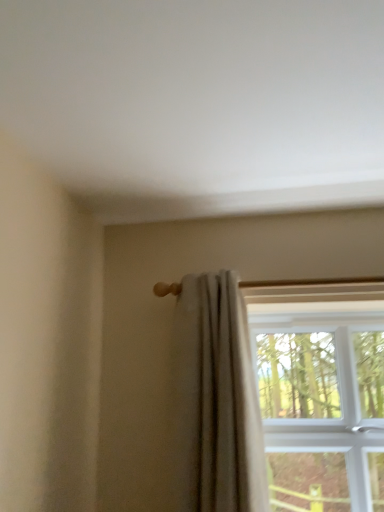
Consider the image. In order to face light beige fabric curtain at center, should I rotate leftwards or rightwards?

You should rotate right by 3.807 degrees.

What do you see at coordinates (215, 400) in the screenshot? Image resolution: width=384 pixels, height=512 pixels. I see `light beige fabric curtain at center` at bounding box center [215, 400].

At what (x,y) coordinates should I click in order to perform the action: click on light beige fabric curtain at center. Please return your answer as a coordinate pair (x, y). This screenshot has height=512, width=384. Looking at the image, I should click on (215, 400).

Identify the location of clear glass window at upper right. (321, 393).

What do you see at coordinates (321, 393) in the screenshot? This screenshot has height=512, width=384. I see `clear glass window at upper right` at bounding box center [321, 393].

The image size is (384, 512). In order to click on light beige fabric curtain at center in this screenshot , I will do `click(215, 400)`.

Is light beige fabric curtain at center at the left side of clear glass window at upper right?

Correct, you'll find light beige fabric curtain at center to the left of clear glass window at upper right.

Considering their positions, is light beige fabric curtain at center located in front of or behind clear glass window at upper right?

In the image, light beige fabric curtain at center appears in front of clear glass window at upper right.

Does point (199, 286) appear closer or farther from the camera than point (283, 447)?

Point (199, 286) is closer to the camera than point (283, 447).

From the image's perspective, is light beige fabric curtain at center positioned above or below clear glass window at upper right?

light beige fabric curtain at center is situated higher than clear glass window at upper right in the image.

From a real-world perspective, does light beige fabric curtain at center stand above clear glass window at upper right?

Yes.

Does light beige fabric curtain at center have a lesser width compared to clear glass window at upper right?

Yes.

From their relative heights in the image, would you say light beige fabric curtain at center is taller or shorter than clear glass window at upper right?

In the image, light beige fabric curtain at center appears to be taller than clear glass window at upper right.

Looking at the image, does light beige fabric curtain at center seem bigger or smaller compared to clear glass window at upper right?

Considering their sizes, light beige fabric curtain at center takes up less space than clear glass window at upper right.

Is light beige fabric curtain at center situated inside clear glass window at upper right or outside?

light beige fabric curtain at center is located beyond the bounds of clear glass window at upper right.

Are light beige fabric curtain at center and clear glass window at upper right far apart?

Actually, light beige fabric curtain at center and clear glass window at upper right are a little close together.

Is light beige fabric curtain at center facing towards clear glass window at upper right?

No, light beige fabric curtain at center does not turn towards clear glass window at upper right.

Where is `curtain on the left of clear glass window at upper right`? curtain on the left of clear glass window at upper right is located at coordinates pos(215,400).

Does clear glass window at upper right appear on the right side of light beige fabric curtain at center?

Yes, clear glass window at upper right is to the right of light beige fabric curtain at center.

Which object is more forward, clear glass window at upper right or light beige fabric curtain at center?

light beige fabric curtain at center is more forward.

Is point (272, 350) positioned behind point (193, 503)?

That is True.

From the image's perspective, which is above, clear glass window at upper right or light beige fabric curtain at center?

light beige fabric curtain at center.

From a real-world perspective, relative to light beige fabric curtain at center, is clear glass window at upper right vertically above or below?

From a real-world perspective, clear glass window at upper right is physically below light beige fabric curtain at center.

Based on the photo, is clear glass window at upper right wider than light beige fabric curtain at center?

Indeed, clear glass window at upper right has a greater width compared to light beige fabric curtain at center.

Which of these two, clear glass window at upper right or light beige fabric curtain at center, stands taller?

light beige fabric curtain at center.

Which of these two, clear glass window at upper right or light beige fabric curtain at center, is smaller?

With smaller size is light beige fabric curtain at center.

Is clear glass window at upper right located outside light beige fabric curtain at center?

Yes.

Would you say clear glass window at upper right is a long distance from light beige fabric curtain at center?

clear glass window at upper right is actually quite close to light beige fabric curtain at center.

Could you tell me if clear glass window at upper right is facing light beige fabric curtain at center?

No.

At what (x,y) coordinates should I click in order to perform the action: click on curtain that is above the clear glass window at upper right (from the image's perspective). Please return your answer as a coordinate pair (x, y). The image size is (384, 512). Looking at the image, I should click on (215, 400).

At what (x,y) coordinates should I click in order to perform the action: click on curtain on the left of clear glass window at upper right. Please return your answer as a coordinate pair (x, y). This screenshot has height=512, width=384. Looking at the image, I should click on (215, 400).

Image resolution: width=384 pixels, height=512 pixels. I want to click on window behind the light beige fabric curtain at center, so click(321, 393).